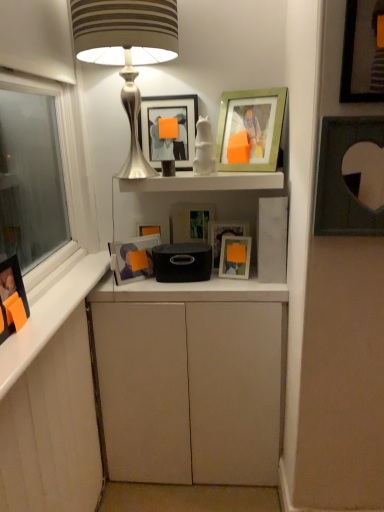
Question: From a real-world perspective, is matte silver picture frame at center, arranged as the 6th picture frame when viewed from the left, positioned over matte white cabinet at center based on gravity?

Choices:
 (A) yes
 (B) no

Answer: (A)

Question: From the image's perspective, is matte silver picture frame at center, arranged as the 6th picture frame when viewed from the left, beneath matte white cabinet at center?

Choices:
 (A) no
 (B) yes

Answer: (A)

Question: Is matte silver picture frame at center, the 4th picture frame from the right, outside of matte white cabinet at center?

Choices:
 (A) no
 (B) yes

Answer: (B)

Question: From the image's perspective, is matte silver picture frame at center, arranged as the 6th picture frame when viewed from the left, on top of matte white cabinet at center?

Choices:
 (A) yes
 (B) no

Answer: (A)

Question: Is matte silver picture frame at center, arranged as the 6th picture frame when viewed from the left, not close to matte white cabinet at center?

Choices:
 (A) yes
 (B) no

Answer: (B)

Question: Is matte silver picture frame at center, arranged as the 6th picture frame when viewed from the left, aimed at matte white cabinet at center?

Choices:
 (A) no
 (B) yes

Answer: (A)

Question: Can you confirm if matte black picture frame at upper right, which is the first picture frame from right to left, is smaller than matte black picture frame at center, which is the 6th picture frame from right to left?

Choices:
 (A) no
 (B) yes

Answer: (B)

Question: Is matte black picture frame at upper right, which is the first picture frame from right to left, at the left side of matte black picture frame at center, which is the 6th picture frame from right to left?

Choices:
 (A) yes
 (B) no

Answer: (B)

Question: Is matte black picture frame at upper right, which is the first picture frame from right to left, taller than matte black picture frame at center, which is the 6th picture frame from right to left?

Choices:
 (A) yes
 (B) no

Answer: (A)

Question: From the image's perspective, is matte black picture frame at upper right, the ninth picture frame from the left, under matte black picture frame at center, which appears as the fourth picture frame when viewed from the left?

Choices:
 (A) no
 (B) yes

Answer: (A)

Question: Is matte black picture frame at upper right, which is the first picture frame from right to left, outside of matte black picture frame at center, which appears as the fourth picture frame when viewed from the left?

Choices:
 (A) yes
 (B) no

Answer: (A)

Question: Is there a large distance between matte black picture frame at upper right, the ninth picture frame from the left, and matte black picture frame at center, which appears as the fourth picture frame when viewed from the left?

Choices:
 (A) yes
 (B) no

Answer: (B)

Question: Would you say matte white picture frame at center, arranged as the fifth picture frame when viewed from the right, is part of matte white cabinet at center's contents?

Choices:
 (A) no
 (B) yes

Answer: (A)